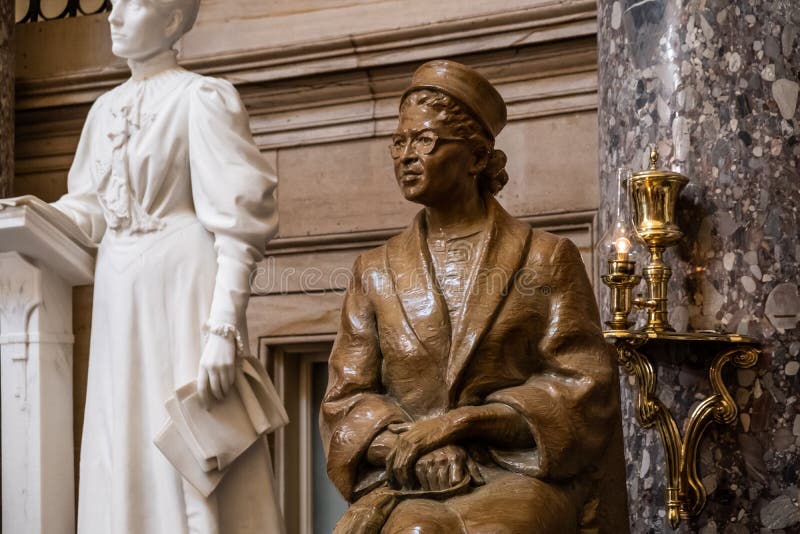
This screenshot has width=800, height=534. Find the location of `candle`. candle is located at coordinates (618, 280).